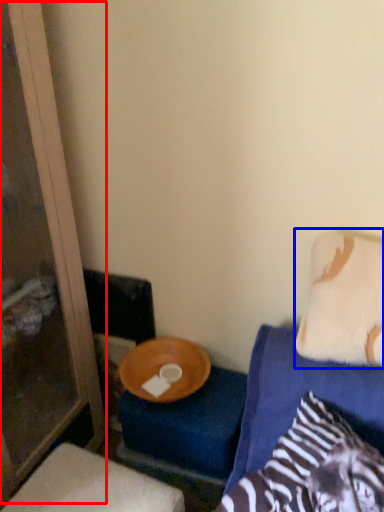
Question: Which object appears closest to the camera in this image, screen door (highlighted by a red box) or pillow (highlighted by a blue box)?

Choices:
 (A) screen door
 (B) pillow

Answer: (A)